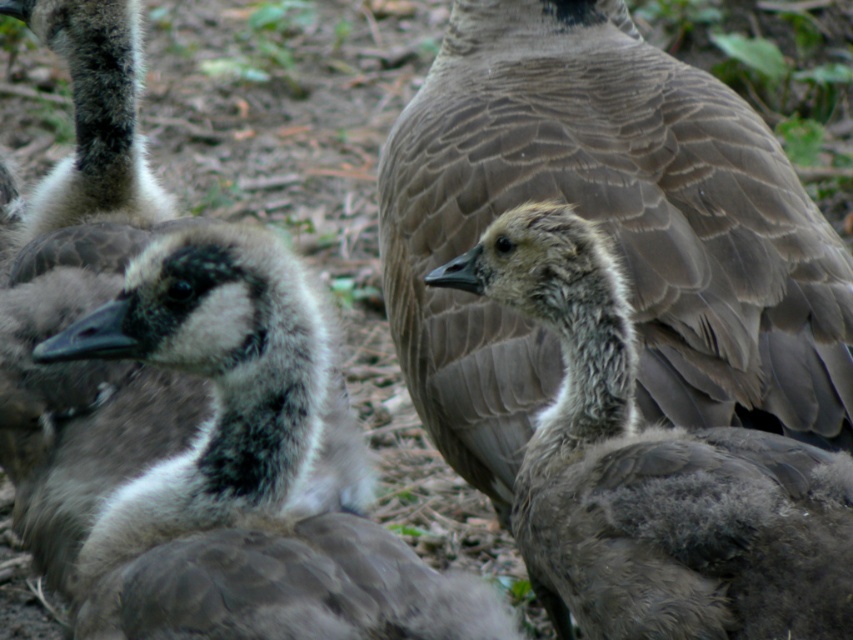
Question: Is dark gray fluffy duckling at left further to the viewer compared to gray downy duckling at center?

Choices:
 (A) yes
 (B) no

Answer: (B)

Question: Which is farther from the gray downy feathers at center?

Choices:
 (A) dark gray fluffy duckling at left
 (B) gray downy duckling at center

Answer: (A)

Question: Which point is closer to the camera?

Choices:
 (A) (236, 291)
 (B) (524, 224)

Answer: (A)

Question: Is gray downy feathers at center further to camera compared to gray downy duckling at center?

Choices:
 (A) yes
 (B) no

Answer: (A)

Question: Which object is farther from the camera taking this photo?

Choices:
 (A) gray downy duckling at center
 (B) dark gray fluffy duckling at left
 (C) gray downy feathers at center

Answer: (C)

Question: Is dark gray fluffy duckling at left above gray downy duckling at center?

Choices:
 (A) no
 (B) yes

Answer: (B)